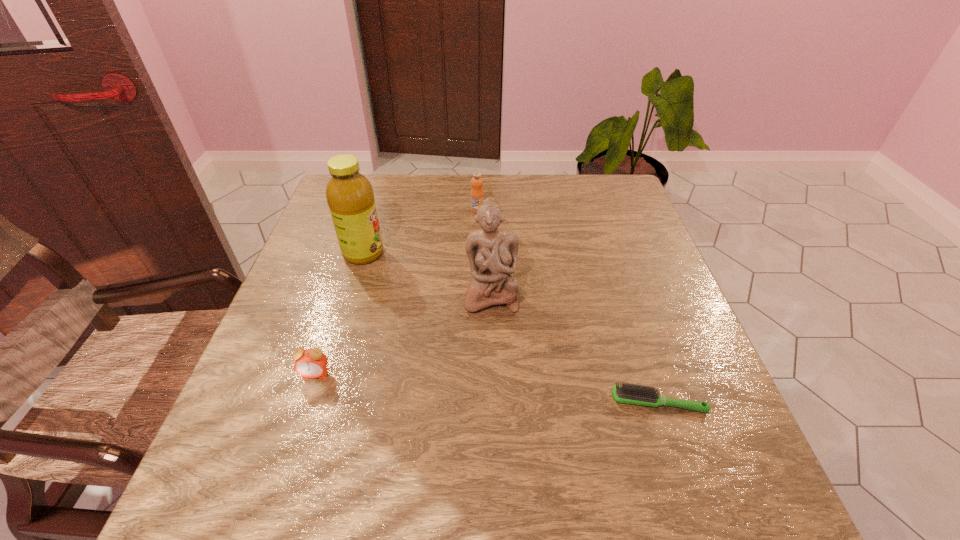
Image resolution: width=960 pixels, height=540 pixels. Identify the location of free spot located on the front label of the third shortest object. (477, 224).

This screenshot has height=540, width=960. What are the coordinates of `free space located 0.200m on the face of the fourth tallest object` in the screenshot? It's located at (279, 485).

Where is `vacant space located 0.210m on the back of the hairbrush`? vacant space located 0.210m on the back of the hairbrush is located at coordinates (627, 309).

This screenshot has height=540, width=960. What are the coordinates of `object that is at the far edge` in the screenshot? It's located at (477, 195).

What are the coordinates of `fruit juice present at the left edge` in the screenshot? It's located at (350, 197).

Identify the location of alarm clock that is at the left edge. (309, 363).

Where is `object that is at the right edge`? This screenshot has width=960, height=540. object that is at the right edge is located at coordinates (629, 393).

Identify the location of blank space at the far edge of the desktop. This screenshot has height=540, width=960. (424, 174).

Image resolution: width=960 pixels, height=540 pixels. Find the location of `vacant space at the near edge`. vacant space at the near edge is located at coordinates 423,505.

This screenshot has height=540, width=960. Identify the location of vacant space at the left edge. (247, 421).